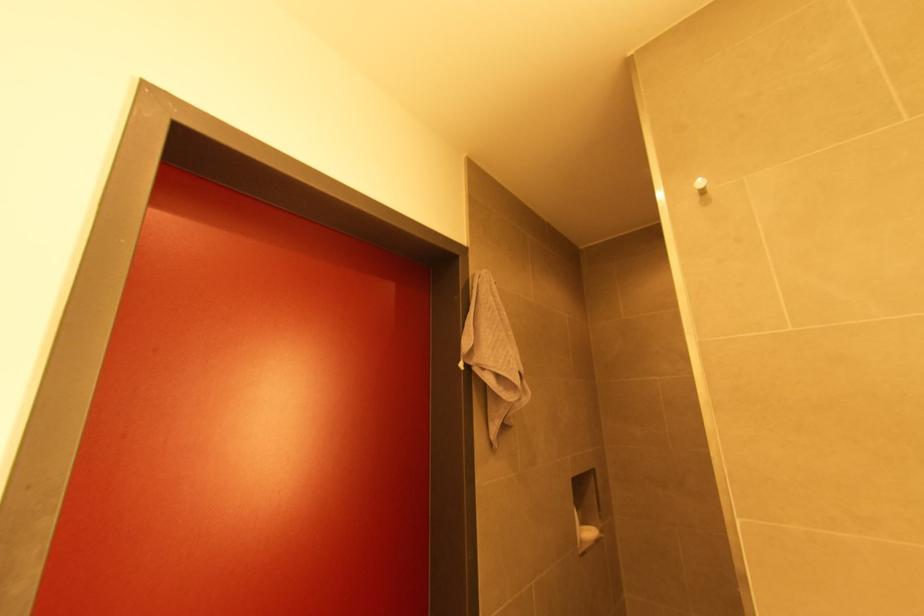
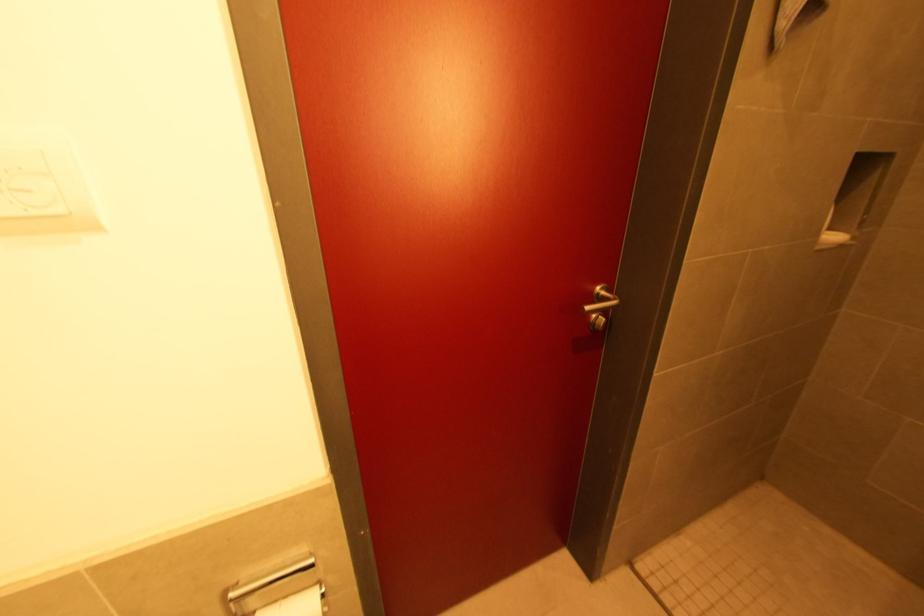
The point at (590, 533) is marked in the first image. Where is the corresponding point in the second image?

(833, 238)